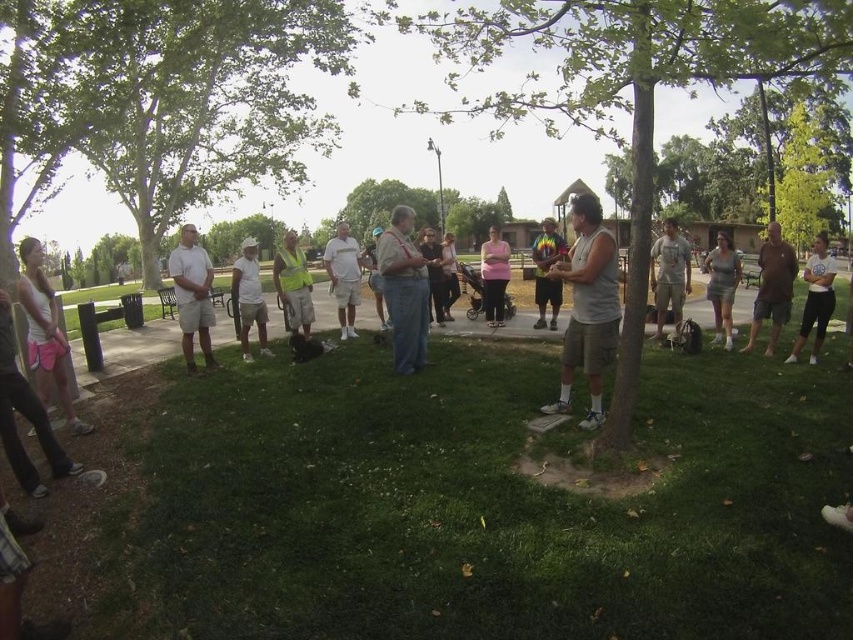
Which is in front, point (28, 362) or point (300, 266)?

Point (28, 362)

Is white tank top at left smaller than reflective yellow vest at center?

Actually, white tank top at left might be larger than reflective yellow vest at center.

Where is `white tank top at left`? Image resolution: width=853 pixels, height=640 pixels. white tank top at left is located at coordinates (44, 332).

Between brown cotton shirt at right and gray fabric backpack at center-right, which one appears on the right side from the viewer's perspective?

Positioned to the right is brown cotton shirt at right.

Does point (773, 244) come closer to viewer compared to point (662, 291)?

Yes, it is.

At what (x,y) coordinates should I click in order to perform the action: click on brown cotton shirt at right. Please return your answer as a coordinate pair (x, y). Image resolution: width=853 pixels, height=640 pixels. Looking at the image, I should click on (772, 285).

Can you confirm if white cotton shirt at right is thinner than denim shorts at center?

Yes, white cotton shirt at right is thinner than denim shorts at center.

Is white cotton shirt at right below denim shorts at center?

Yes.

Is point (820, 266) in front of point (378, 230)?

Yes, point (820, 266) is in front of point (378, 230).

What are the coordinates of `white cotton shirt at right` in the screenshot? It's located at (815, 298).